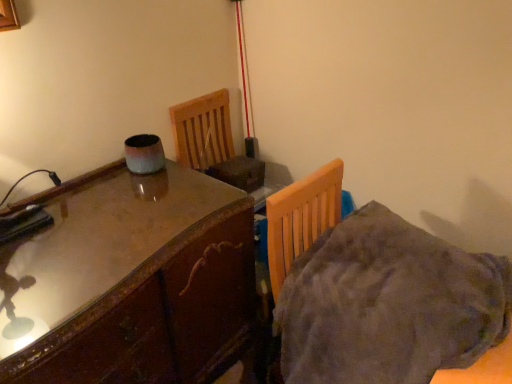
Question: Is fuzzy gray blanket at lower right bigger than glossy wood table at left?

Choices:
 (A) no
 (B) yes

Answer: (A)

Question: From the image's perspective, is fuzzy gray blanket at lower right below glossy wood table at left?

Choices:
 (A) yes
 (B) no

Answer: (B)

Question: Does fuzzy gray blanket at lower right have a lesser height compared to glossy wood table at left?

Choices:
 (A) yes
 (B) no

Answer: (A)

Question: Considering the relative sizes of fuzzy gray blanket at lower right and glossy wood table at left in the image provided, is fuzzy gray blanket at lower right smaller than glossy wood table at left?

Choices:
 (A) yes
 (B) no

Answer: (A)

Question: Considering the relative sizes of fuzzy gray blanket at lower right and glossy wood table at left in the image provided, is fuzzy gray blanket at lower right taller than glossy wood table at left?

Choices:
 (A) no
 (B) yes

Answer: (A)

Question: Can you confirm if fuzzy gray blanket at lower right is wider than glossy wood table at left?

Choices:
 (A) no
 (B) yes

Answer: (A)

Question: Is glossy wood table at left positioned with its back to fuzzy gray blanket at lower right?

Choices:
 (A) no
 (B) yes

Answer: (A)

Question: From the image's perspective, would you say glossy wood table at left is shown under fuzzy gray blanket at lower right?

Choices:
 (A) no
 (B) yes

Answer: (B)

Question: Is glossy wood table at left oriented towards fuzzy gray blanket at lower right?

Choices:
 (A) yes
 (B) no

Answer: (A)

Question: From a real-world perspective, is glossy wood table at left over fuzzy gray blanket at lower right?

Choices:
 (A) yes
 (B) no

Answer: (B)

Question: Does glossy wood table at left come in front of fuzzy gray blanket at lower right?

Choices:
 (A) no
 (B) yes

Answer: (A)

Question: Is glossy wood table at left in contact with fuzzy gray blanket at lower right?

Choices:
 (A) no
 (B) yes

Answer: (A)

Question: Relative to fuzzy gray blanket at lower right, is glossy wood table at left in front or behind?

Choices:
 (A) behind
 (B) front

Answer: (A)